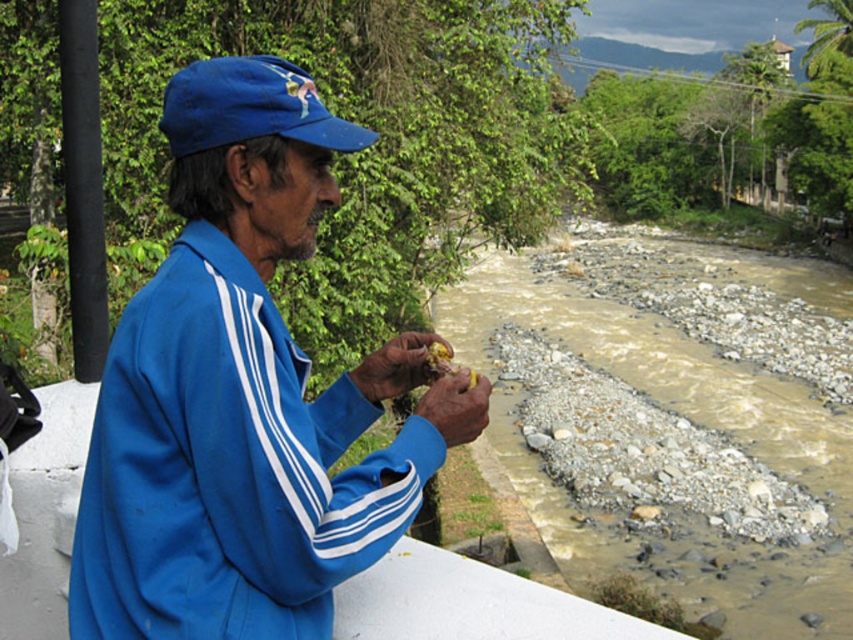
Is blue fabric jacket at left smaller than blue fabric baseball cap at upper left?

Actually, blue fabric jacket at left might be larger than blue fabric baseball cap at upper left.

Is blue fabric jacket at left wider than blue fabric baseball cap at upper left?

Yes, blue fabric jacket at left is wider than blue fabric baseball cap at upper left.

Image resolution: width=853 pixels, height=640 pixels. Find the location of `blue fabric jacket at left`. blue fabric jacket at left is located at coordinates (233, 394).

Is yellow matte fruit at center positioned at the back of yellow matte food at center?

Yes.

Locate an element on the screen. This screenshot has width=853, height=640. yellow matte fruit at center is located at coordinates (396, 365).

Who is more distant from viewer, (296, 157) or (399, 371)?

Point (399, 371)

Find the location of a particular element. This screenshot has width=853, height=640. blue fabric jacket at left is located at coordinates (233, 394).